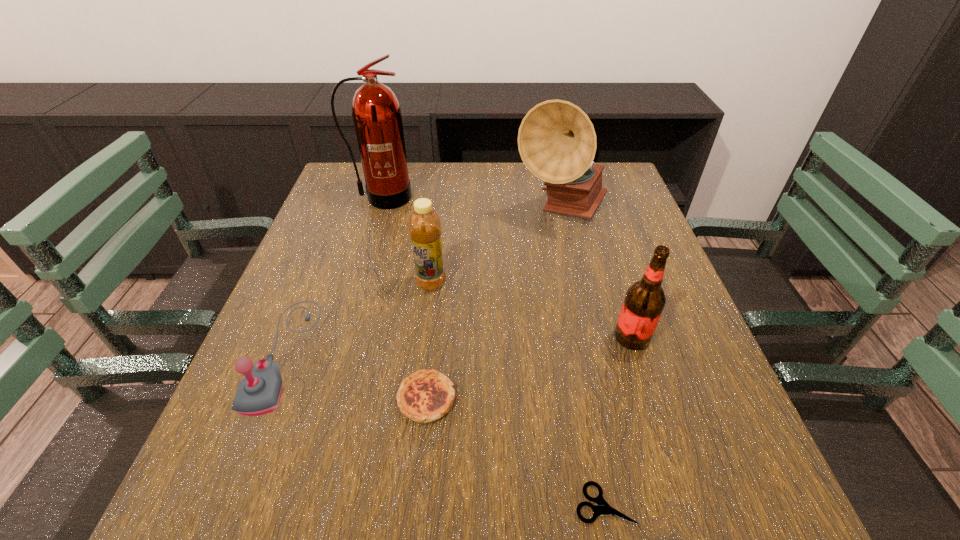
Select which object appears as the third closest to the quiche. Please provide its 2D coordinates. Your answer should be formatted as a tuple, i.e. [(x, y)], where the tuple contains the x and y coordinates of a point satisfying the conditions above.

[(425, 230)]

This screenshot has width=960, height=540. Identify the location of vacant point that satisfies the following two spatial constraints: 1. on the front side of the third shortest object; 2. on the right side of the nearest object. (224, 504).

You are a GUI agent. You are given a task and a screenshot of the screen. Output one action in this format:
    pyautogui.click(x=<x>, y=<y>)
    Task: Click on the free space that satisfies the following two spatial constraints: 1. on the horn of the root beer; 2. on the right side of the phonograph record
    Image resolution: width=960 pixels, height=540 pixels.
    Given the screenshot: What is the action you would take?
    pyautogui.click(x=590, y=338)

The width and height of the screenshot is (960, 540). In order to click on free location that satisfies the following two spatial constraints: 1. on the front-facing side of the shortest object; 2. on the right side of the fire extinguisher in this screenshot , I will do `click(291, 504)`.

Identify the location of free space that satisfies the following two spatial constraints: 1. on the front-facing side of the fire extinguisher; 2. on the right side of the sixth tallest object. The width and height of the screenshot is (960, 540). coord(322,398).